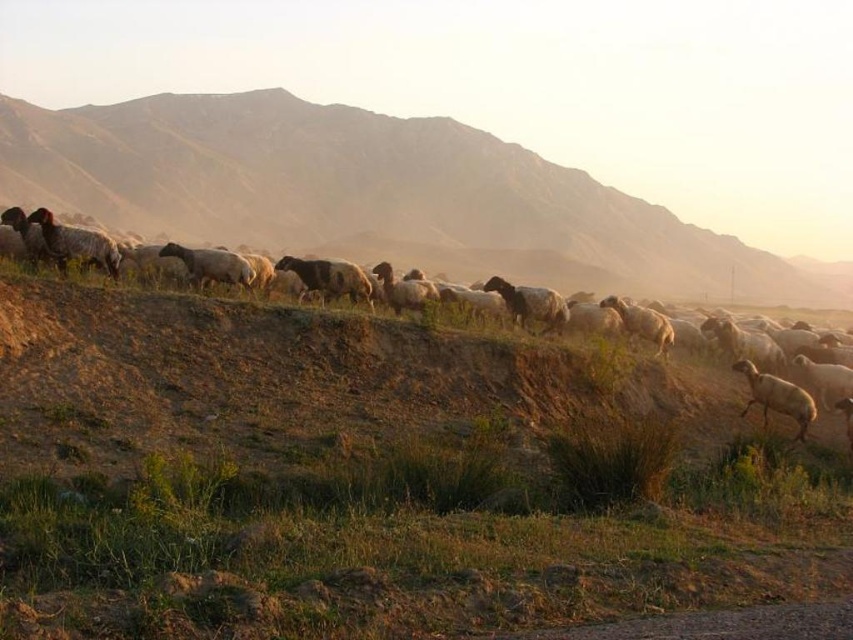
You are standing on the dirt path in the pastoral scene. You want to walk towards the brown grassy hillside at center. Which direction should you head from the green grassy at lower center?

You should head to the right from the green grassy at lower center to reach the brown grassy hillside at center since the green grassy at lower center is to the left of brown grassy hillside at center.